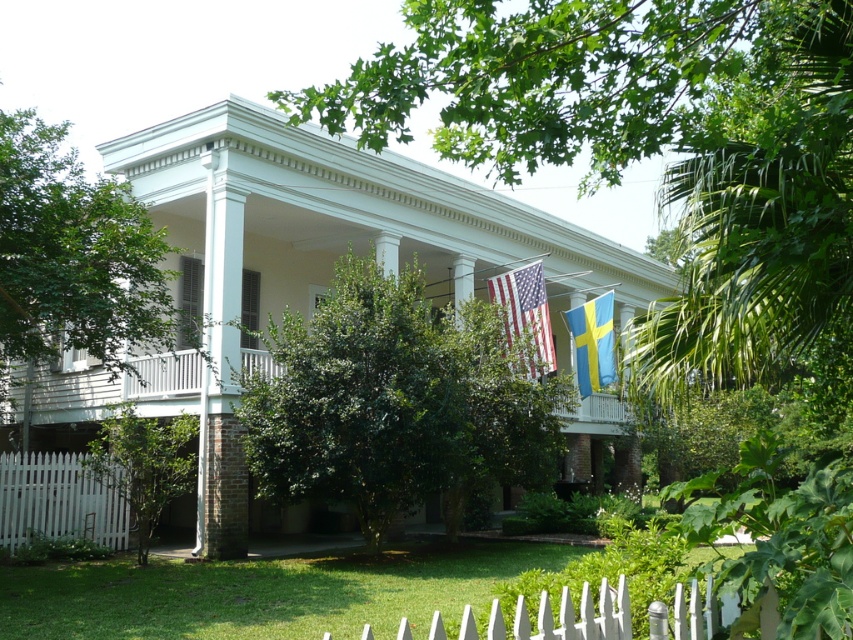
Question: Estimate the real-world distances between objects in this image. Which object is farther from the american flag at center?

Choices:
 (A) white picket fence at lower left
 (B) blue/yellow fabric flag at upper right
 (C) white picket fence at lower center

Answer: (C)

Question: Considering the relative positions of white picket fence at lower center and white picket fence at lower left in the image provided, where is white picket fence at lower center located with respect to white picket fence at lower left?

Choices:
 (A) below
 (B) above

Answer: (B)

Question: Which object appears closest to the camera in this image?

Choices:
 (A) white picket fence at lower center
 (B) blue/yellow fabric flag at upper right
 (C) white picket fence at lower left
 (D) american flag at center

Answer: (A)

Question: Which object is closer to the camera taking this photo?

Choices:
 (A) white picket fence at lower center
 (B) american flag at center
 (C) white picket fence at lower left

Answer: (A)

Question: Is american flag at center above blue/yellow fabric flag at upper right?

Choices:
 (A) yes
 (B) no

Answer: (B)

Question: Does white picket fence at lower center have a smaller size compared to american flag at center?

Choices:
 (A) no
 (B) yes

Answer: (A)